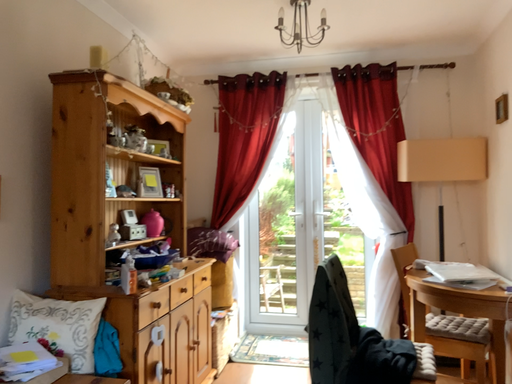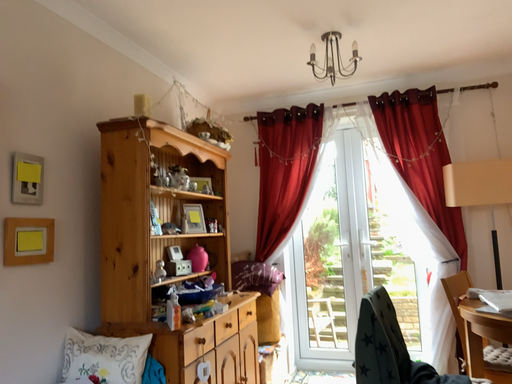
Question: How did the camera likely rotate when shooting the video?

Choices:
 (A) rotated left
 (B) rotated right

Answer: (A)